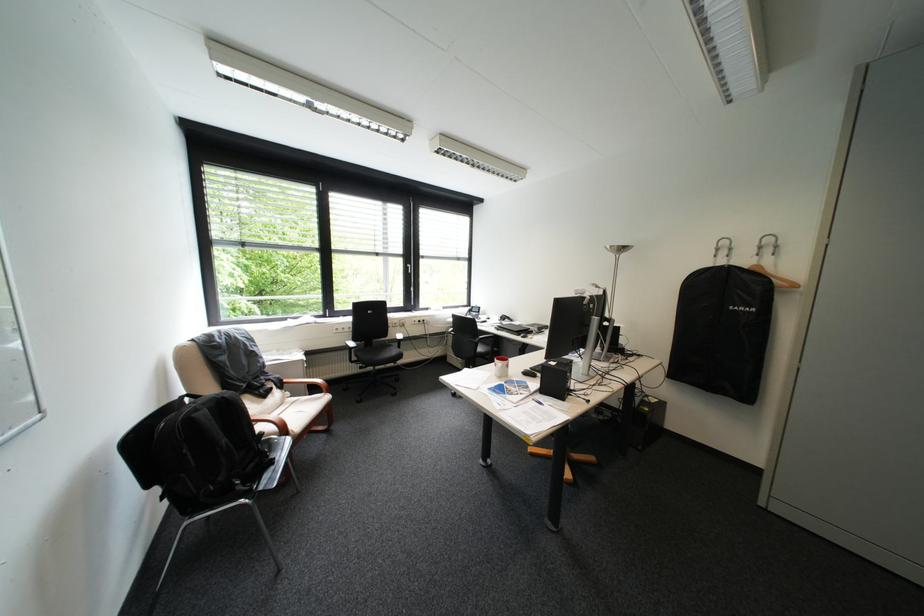
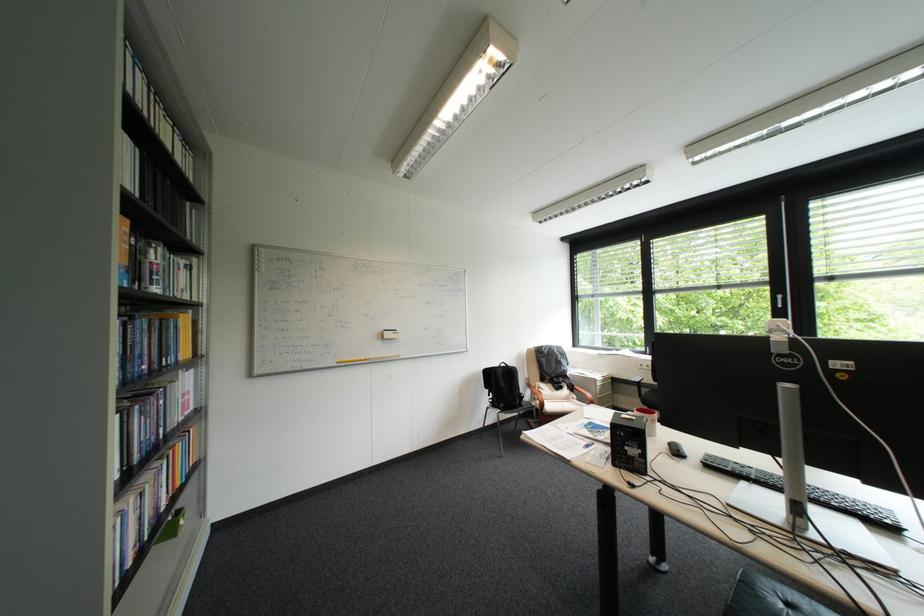
The point at (314,361) is marked in the first image. Where is the corresponding point in the second image?

(608, 379)